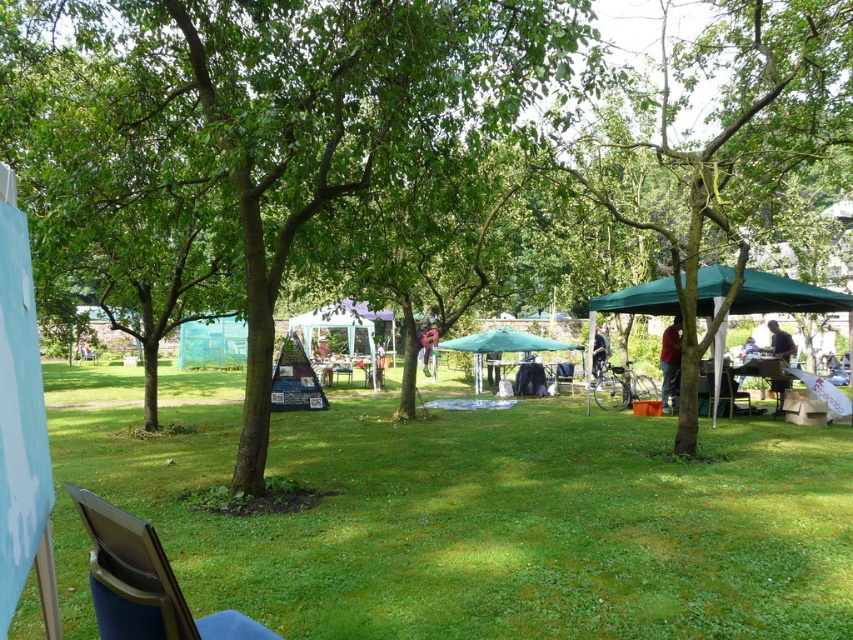
Question: Observing the image, what is the correct spatial positioning of blue fabric folding chair at lower left in reference to matte black backpack at center?

Choices:
 (A) right
 (B) left

Answer: (A)

Question: Among these points, which one is farthest from the camera?

Choices:
 (A) (784, 352)
 (B) (665, 336)
 (C) (572, 364)

Answer: (C)

Question: Can you confirm if blue fabric chair at center is positioned above matte black backpack at center?

Choices:
 (A) no
 (B) yes

Answer: (A)

Question: Which of the following is the closest to the observer?

Choices:
 (A) reddish-pink fabric at center
 (B) dark brown leather jacket at lower right
 (C) blue fabric folding chair at lower left

Answer: (C)

Question: Does blue fabric folding chair at lower left have a larger size compared to green fabric umbrella at center?

Choices:
 (A) yes
 (B) no

Answer: (A)

Question: Which of the following is the farthest from the observer?

Choices:
 (A) green leafy tree at center
 (B) matte black backpack at center
 (C) dark brown leather jacket at center

Answer: (B)